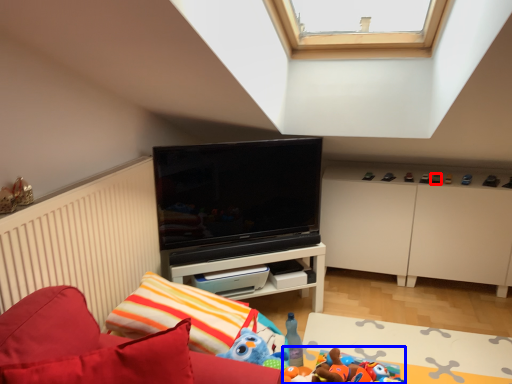
Question: Which object appears farthest to the camera in this image, toy (highlighted by a red box) or toy (highlighted by a blue box)?

Choices:
 (A) toy
 (B) toy

Answer: (A)